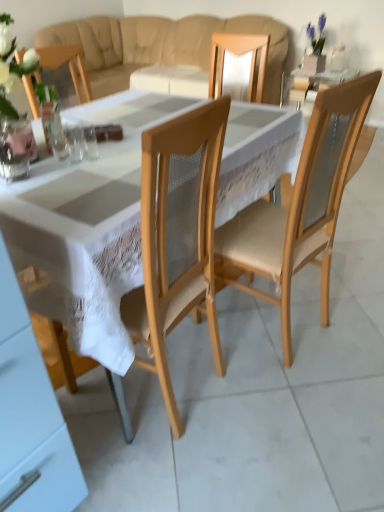
Find the location of `vacant area to the left of clear glass at center, which ranks as the 2th tableware in right-to-left order`. vacant area to the left of clear glass at center, which ranks as the 2th tableware in right-to-left order is located at coordinates (29, 161).